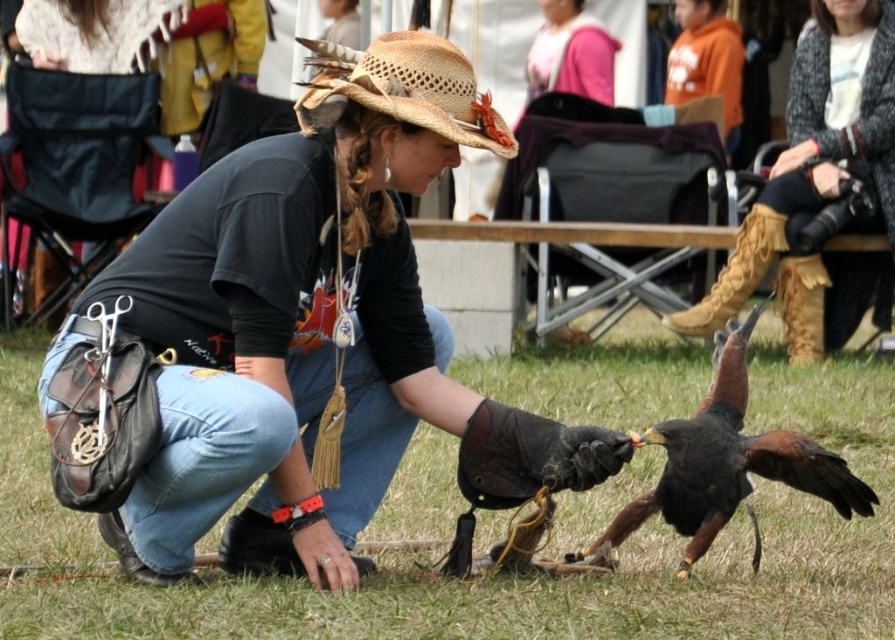
What is the width comparison between the matte black shirt at center and the leather fringe boots at lower right?

The matte black shirt at center is wider than the leather fringe boots at lower right.